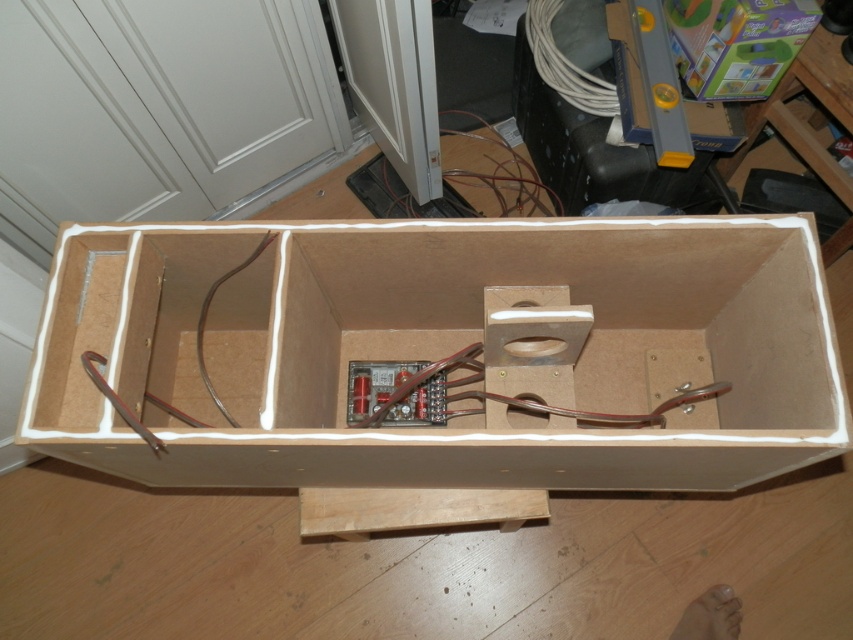
You are an engineer working on assembling the wooden box. You need to place the green cardboard box at upper right and the white cable at upper right into the box. Which object should you place first if you want to ensure that the taller object is placed first to prevent blocking access to the lower section?

The white cable at upper right is taller than the green cardboard box at upper right, so you should place the white cable at upper right first to prevent blocking access to the lower section.

You are standing in front of the wooden box and want to place a small tool on the partition between the two sections. The partition has two points marked as point 1 at coordinates point (428,289) and point 2 at coordinates point (576,77). Which point is closer to you so that you can easily reach it without moving your hand too far?

Point (428,289) is closer to the camera than point (576,77), so you can easily reach it without moving your hand too far.

You are a delivery person who needs to stack the brown cardboard box at center and the green cardboard box at upper right onto a shelf. The shelf has limited space, and you can only place one box on top of the other. Based on their sizes, which box should you place at the bottom to ensure stability?

The brown cardboard box at center is larger than the green cardboard box at upper right, so placing the brown cardboard box at center at the bottom will provide a more stable base for stacking.